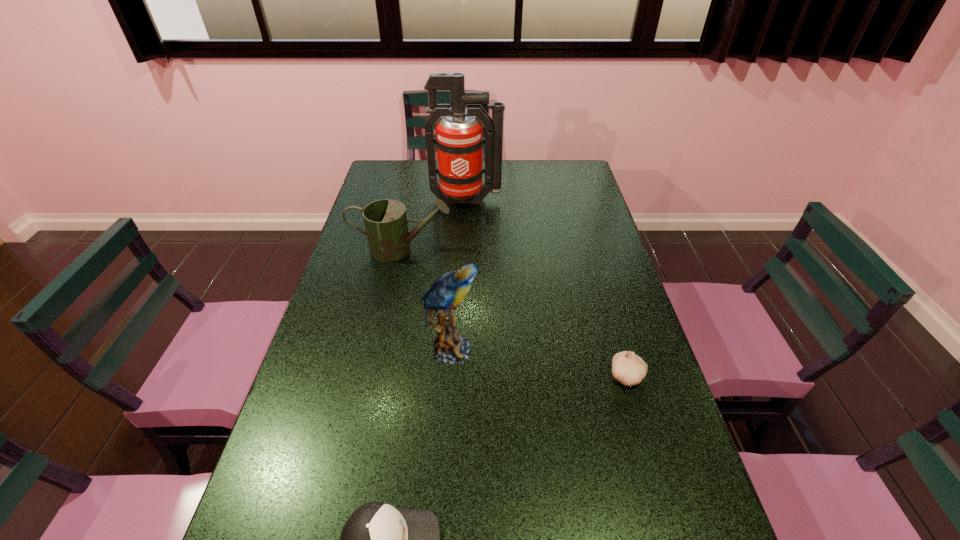
Point out which object is positioned as the fourth nearest to the rightmost object. Please provide its 2D coordinates. Your answer should be formatted as a tuple, i.e. [(x, y)], where the tuple contains the x and y coordinates of a point satisfying the conditions above.

[(459, 138)]

Choose which object is the second nearest neighbor to the garlic. Please provide its 2D coordinates. Your answer should be formatted as a tuple, i.e. [(x, y)], where the tuple contains the x and y coordinates of a point satisfying the conditions above.

[(377, 539)]

Image resolution: width=960 pixels, height=540 pixels. In order to click on vacant space that satisfies the following two spatial constraints: 1. on the back side of the rightmost object; 2. with the spout on the third shortest object in this screenshot , I will do `click(589, 249)`.

Where is `vacant region that satisfies the following two spatial constraints: 1. on the back side of the garlic; 2. on the face of the parrot`? vacant region that satisfies the following two spatial constraints: 1. on the back side of the garlic; 2. on the face of the parrot is located at coordinates (619, 349).

Where is `free space that satisfies the following two spatial constraints: 1. on the front label side of the farthest object; 2. on the face of the fourth shortest object`? free space that satisfies the following two spatial constraints: 1. on the front label side of the farthest object; 2. on the face of the fourth shortest object is located at coordinates (461, 349).